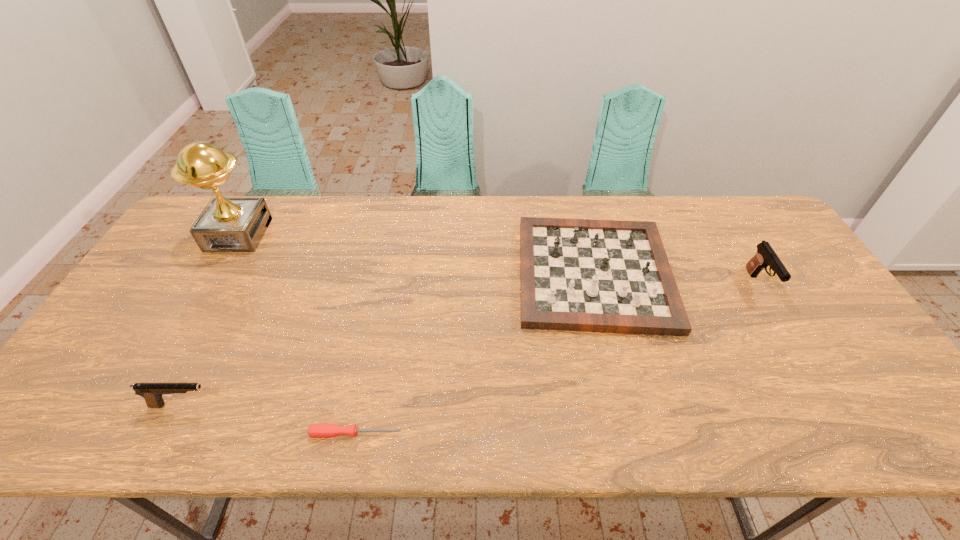
At what (x,y) coordinates should I click in order to perform the action: click on free space between the award and the screwdriver. Please return your answer as a coordinate pair (x, y). The width and height of the screenshot is (960, 540). Looking at the image, I should click on (298, 334).

You are a GUI agent. You are given a task and a screenshot of the screen. Output one action in this format:
    pyautogui.click(x=<x>, y=<y>)
    Task: Click on the vacant space that's between the second nearest object and the tallest object
    The height and width of the screenshot is (540, 960).
    Given the screenshot: What is the action you would take?
    pyautogui.click(x=210, y=320)

Locate an element on the screen. Image resolution: width=960 pixels, height=540 pixels. unoccupied position between the tallest object and the chessboard is located at coordinates (417, 254).

Where is `blank region between the tallest object and the chessboard`? blank region between the tallest object and the chessboard is located at coordinates (417, 254).

Identify which object is located as the third nearest to the chessboard. Please provide its 2D coordinates. Your answer should be formatted as a tuple, i.e. [(x, y)], where the tuple contains the x and y coordinates of a point satisfying the conditions above.

[(152, 392)]

Image resolution: width=960 pixels, height=540 pixels. What are the coordinates of `object that ranks as the closest to the farther pistol` in the screenshot? It's located at (610, 276).

Identify the location of free space that satisfies the following two spatial constraints: 1. at the barrel of the right pistol; 2. at the tip of the nearest object. (848, 433).

Where is `free point that satisfies the following two spatial constraints: 1. at the barrel of the farther pistol; 2. at the tip of the screwdriver`? This screenshot has height=540, width=960. free point that satisfies the following two spatial constraints: 1. at the barrel of the farther pistol; 2. at the tip of the screwdriver is located at coordinates (848, 433).

At what (x,y) coordinates should I click in order to perform the action: click on free location that satisfies the following two spatial constraints: 1. at the barrel of the fourth shortest object; 2. at the muzzle of the left pistol. Please return your answer as a coordinate pair (x, y). Image resolution: width=960 pixels, height=540 pixels. Looking at the image, I should click on (830, 405).

Where is `vacant point that satisfies the following two spatial constraints: 1. on the front-facing side of the award; 2. on the left side of the chessboard`? vacant point that satisfies the following two spatial constraints: 1. on the front-facing side of the award; 2. on the left side of the chessboard is located at coordinates (216, 274).